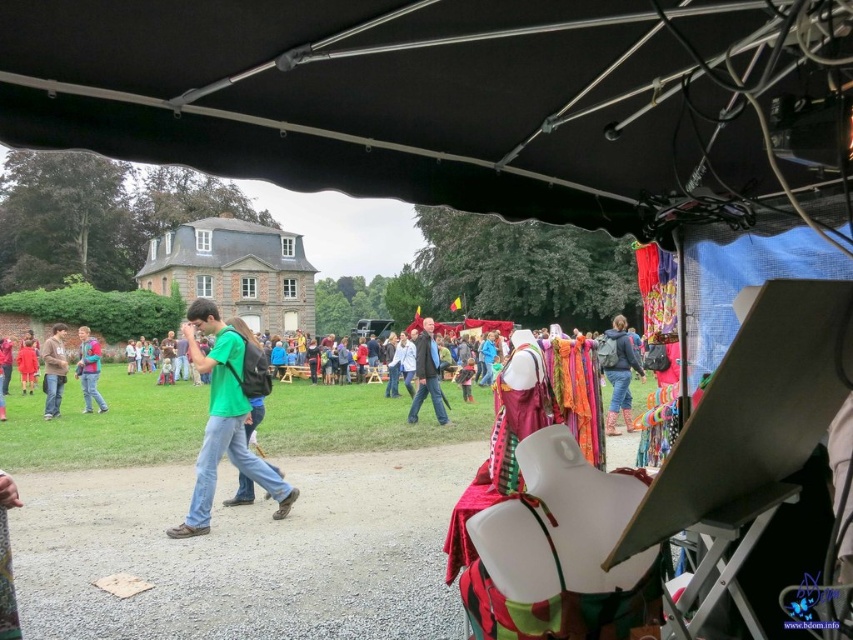
Question: Can you confirm if matte blue backpack at center is bigger than blue denim jeans at left?

Choices:
 (A) no
 (B) yes

Answer: (B)

Question: Is dark gray jacket at center closer to camera compared to brown cotton shirt at left?

Choices:
 (A) no
 (B) yes

Answer: (A)

Question: Among these objects, which one is nearest to the camera?

Choices:
 (A) matte blue backpack at center
 (B) blue denim jeans at left
 (C) brown cotton shirt at left

Answer: (A)

Question: Can you confirm if green matte shirt at center is smaller than brown cotton shirt at left?

Choices:
 (A) no
 (B) yes

Answer: (A)

Question: Which object is positioned farthest from the dark gray jacket at center?

Choices:
 (A) matte blue backpack at center
 (B) brown cotton shirt at left

Answer: (B)

Question: Considering the real-world distances, which object is closest to the dark gray jacket at center?

Choices:
 (A) black fabric canopy at upper center
 (B) matte blue backpack at center
 (C) green matte shirt at center

Answer: (B)